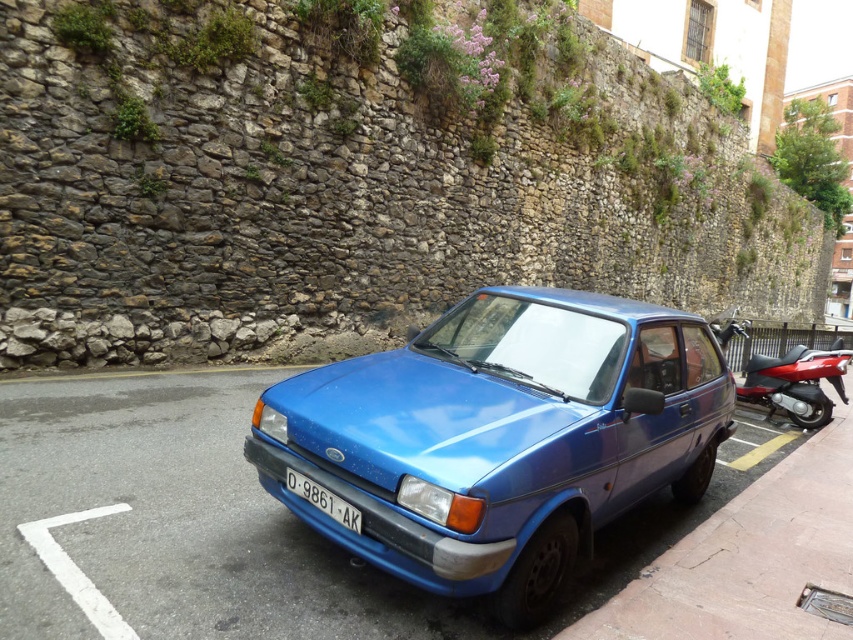
You are a delivery person trying to park your motorcycle between the metallic blue car at center and the blue asphalt pavement at center. Can you tell me which one is higher so you know where to position your motorcycle?

The metallic blue car at center is located above the blue asphalt pavement at center, so you should position your motorcycle on the lower side near the blue asphalt pavement at center.